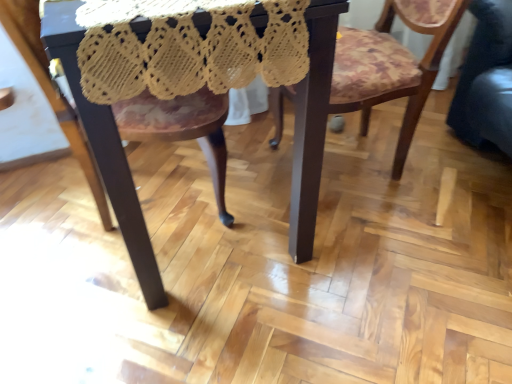
Identify the location of free space between wooden floral-patterned chair at center, the first chair viewed from the right, and dark brown polished wood table at center. (332, 179).